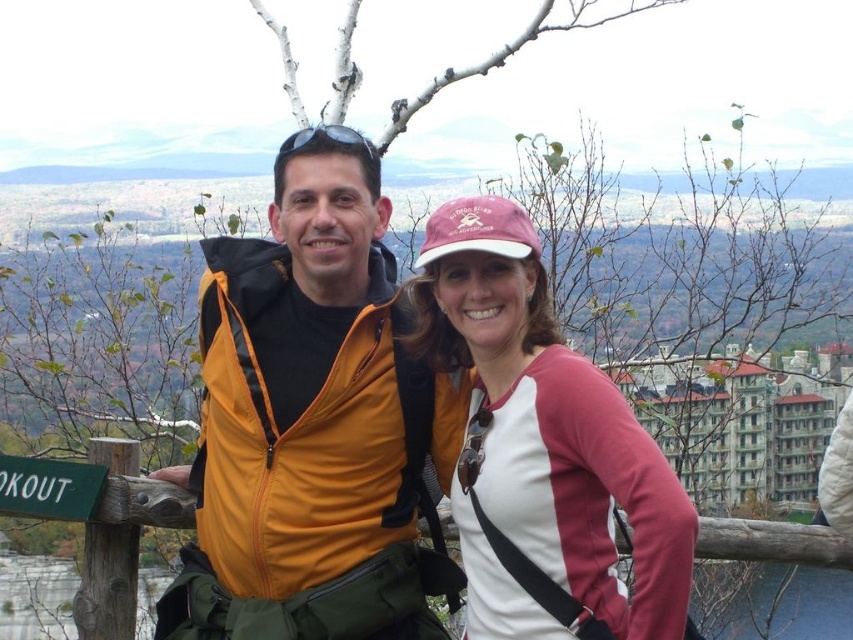
Consider the image. Is yellow softshell jacket at center further to camera compared to pink fabric baseball cap at upper center?

Yes, it is.

What do you see at coordinates (309, 422) in the screenshot? I see `yellow softshell jacket at center` at bounding box center [309, 422].

I want to click on yellow softshell jacket at center, so click(x=309, y=422).

In the scene shown: Is pink fabric baseball cap at upper center further to camera compared to green wood sign at lower left?

No, it is in front of green wood sign at lower left.

Looking at this image, who is taller, pink fabric baseball cap at upper center or green wood sign at lower left?

pink fabric baseball cap at upper center is taller.

Measure the distance between point [541,516] and camera.

Point [541,516] and camera are 319.86 meters apart.

In order to click on pink fabric baseball cap at upper center in this screenshot , I will do `click(543, 449)`.

Does yellow softshell jacket at center lie in front of green wood sign at lower left?

Yes, yellow softshell jacket at center is in front of green wood sign at lower left.

Between yellow softshell jacket at center and green wood sign at lower left, which one is positioned lower?

green wood sign at lower left

Does point (355, 577) come in front of point (10, 497)?

Yes, it is in front of point (10, 497).

Locate an element on the screen. This screenshot has height=640, width=853. yellow softshell jacket at center is located at coordinates (309, 422).